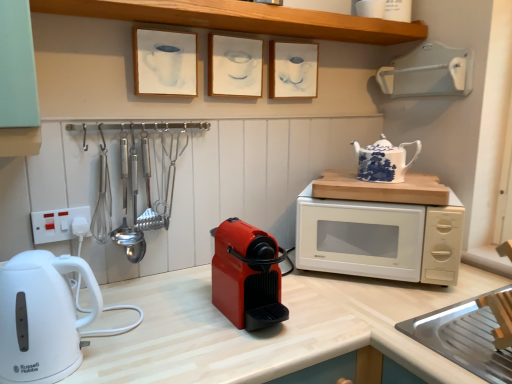
Question: Which direction should I rotate to face white paper picture frame at upper center, which is counted as the third picture frame, starting from the right, — up or down?

Choices:
 (A) down
 (B) up

Answer: (B)

Question: Is matte white picture frame at upper center, arranged as the first picture frame when viewed from the right, oriented towards white matte microwave at right?

Choices:
 (A) no
 (B) yes

Answer: (A)

Question: Would you say white matte microwave at right is part of matte white picture frame at upper center, arranged as the first picture frame when viewed from the right,'s contents?

Choices:
 (A) no
 (B) yes

Answer: (A)

Question: From a real-world perspective, is matte white picture frame at upper center, the third picture frame positioned from the left, positioned over white matte microwave at right based on gravity?

Choices:
 (A) yes
 (B) no

Answer: (A)

Question: Does matte white picture frame at upper center, arranged as the first picture frame when viewed from the right, have a larger size compared to white matte microwave at right?

Choices:
 (A) yes
 (B) no

Answer: (B)

Question: Would you consider matte white picture frame at upper center, arranged as the first picture frame when viewed from the right, to be distant from white matte microwave at right?

Choices:
 (A) no
 (B) yes

Answer: (A)

Question: Is matte white picture frame at upper center, the third picture frame positioned from the left, directly adjacent to white matte microwave at right?

Choices:
 (A) yes
 (B) no

Answer: (B)

Question: Is matte white picture frame at upper center, arranged as the first picture frame when viewed from the right, facing away from matte white picture frame at center, the second picture frame viewed from the left?

Choices:
 (A) no
 (B) yes

Answer: (A)

Question: Is matte white picture frame at upper center, the third picture frame positioned from the left, outside matte white picture frame at center, the second picture frame viewed from the left?

Choices:
 (A) yes
 (B) no

Answer: (A)

Question: Is matte white picture frame at upper center, arranged as the first picture frame when viewed from the right, shorter than matte white picture frame at center, the second picture frame viewed from the left?

Choices:
 (A) no
 (B) yes

Answer: (A)

Question: From a real-world perspective, is matte white picture frame at upper center, the third picture frame positioned from the left, on top of matte white picture frame at center, the second picture frame viewed from the left?

Choices:
 (A) no
 (B) yes

Answer: (A)

Question: From a real-world perspective, is matte white picture frame at upper center, the third picture frame positioned from the left, under matte white picture frame at center, positioned as the 2th picture frame in right-to-left order?

Choices:
 (A) no
 (B) yes

Answer: (B)

Question: Considering the relative positions of matte white picture frame at upper center, the third picture frame positioned from the left, and matte white picture frame at center, positioned as the 2th picture frame in right-to-left order, in the image provided, is matte white picture frame at upper center, the third picture frame positioned from the left, to the right of matte white picture frame at center, positioned as the 2th picture frame in right-to-left order, from the viewer's perspective?

Choices:
 (A) no
 (B) yes

Answer: (B)

Question: Is wooden at upper center thinner than matte plastic coffee machine at center, which is the first home appliance in right-to-left order?

Choices:
 (A) no
 (B) yes

Answer: (B)